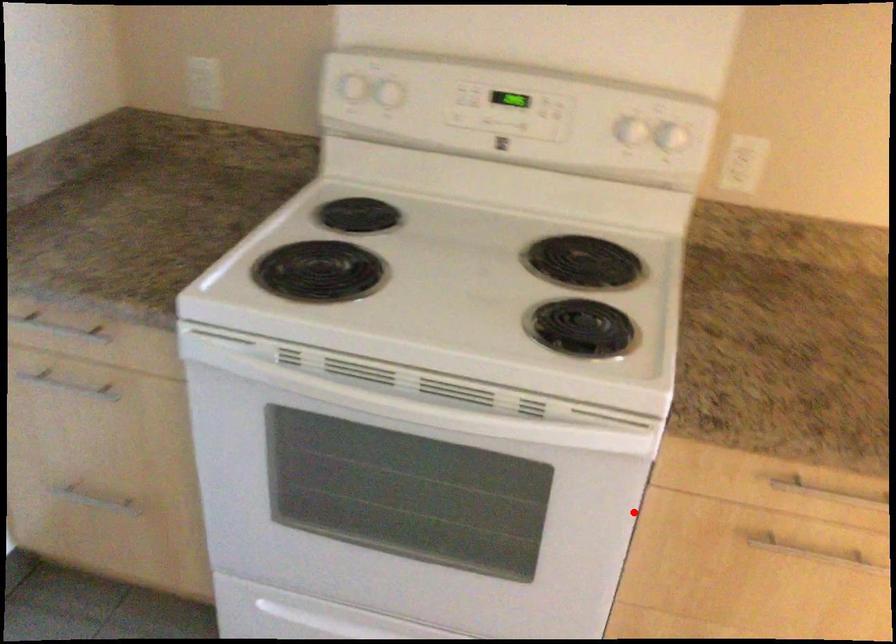
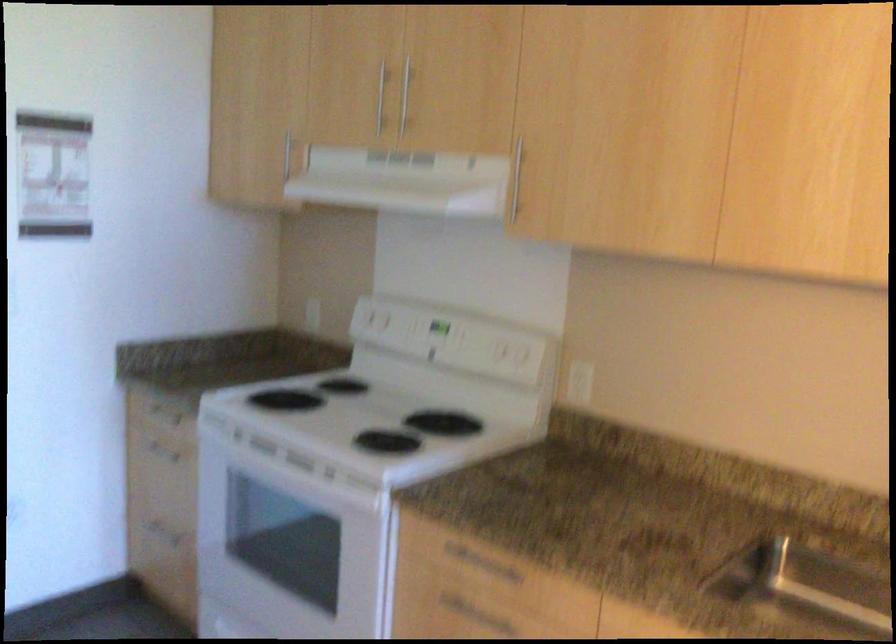
Question: I am providing you with two images of the same scene from different viewpoints. A red point is marked on the first image. Is the red point's position out of view in image 2?

Choices:
 (A) Yes
 (B) No

Answer: (B)